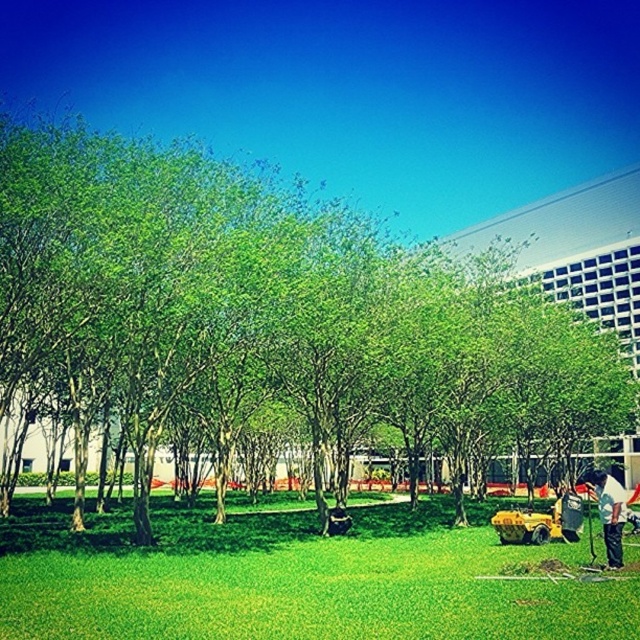
You are standing on the grassy area and want to take a photo of the white fabric shirt at lower right without the green leafy tree at center blocking the view. Which direction should you move to achieve this?

The green leafy tree at center is located above the white fabric shirt at lower right. To avoid the tree blocking the view of the white fabric shirt at lower right, you should move to the right or left side so that the tree is no longer directly above the shirt in your line of sight.

You are standing in the middle of the green grass at lower center and want to walk towards the building in the background. Which direction should you walk to avoid the green leafy tree at center?

To avoid the green leafy tree at center, you should walk to the right since the green leafy tree at center is located to the left of the green grass at lower center, so moving right would bypass it.

You are a photographer setting up a shot of the green leafy tree at center and the white fabric shirt at lower right. Which object should you focus on first if you want to capture both in sharp focus?

The green leafy tree at center is taller than the white fabric shirt at lower right, so you should focus on the green leafy tree at center first to ensure both are in sharp focus.